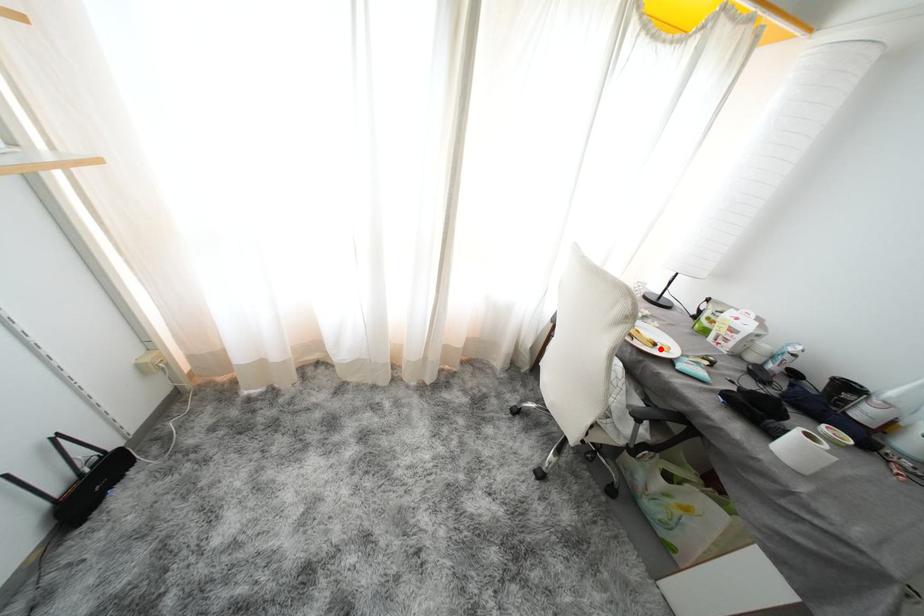
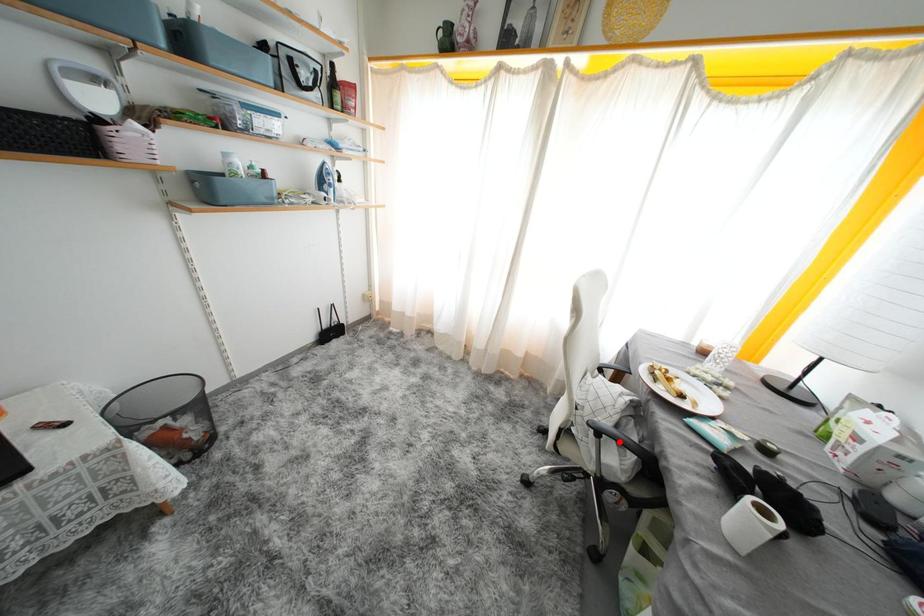
I am providing you with two images of the same scene from different viewpoints. A red point is marked on the first image and another point is marked on the second image. Is the red point in image1 aligned with the point shown in image2?

No